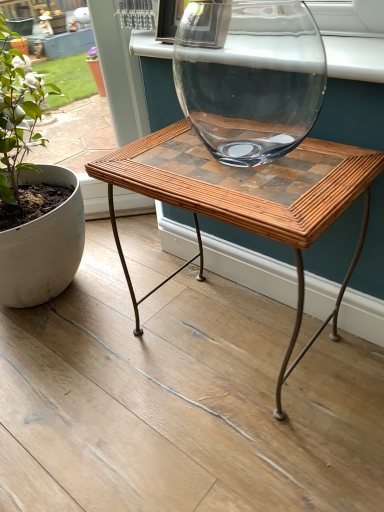
Question: From a real-world perspective, is green matte plant at left located beneath clear glass vase at upper center?

Choices:
 (A) yes
 (B) no

Answer: (A)

Question: Does green matte plant at left have a lesser width compared to clear glass vase at upper center?

Choices:
 (A) yes
 (B) no

Answer: (B)

Question: Is green matte plant at left positioned before clear glass vase at upper center?

Choices:
 (A) yes
 (B) no

Answer: (A)

Question: From the image's perspective, does green matte plant at left appear higher than clear glass vase at upper center?

Choices:
 (A) yes
 (B) no

Answer: (B)

Question: Is green matte plant at left shorter than clear glass vase at upper center?

Choices:
 (A) yes
 (B) no

Answer: (B)

Question: From the image's perspective, is green matte plant at left beneath clear glass vase at upper center?

Choices:
 (A) yes
 (B) no

Answer: (A)

Question: Is woven wood table at center wider than clear glass vase at upper center?

Choices:
 (A) yes
 (B) no

Answer: (A)

Question: Is the depth of woven wood table at center greater than that of clear glass vase at upper center?

Choices:
 (A) no
 (B) yes

Answer: (A)

Question: From a real-world perspective, is woven wood table at center over clear glass vase at upper center?

Choices:
 (A) yes
 (B) no

Answer: (B)

Question: From the image's perspective, is woven wood table at center beneath clear glass vase at upper center?

Choices:
 (A) no
 (B) yes

Answer: (B)

Question: Is woven wood table at center positioned in front of clear glass vase at upper center?

Choices:
 (A) no
 (B) yes

Answer: (B)

Question: Can you confirm if woven wood table at center is positioned to the left of clear glass vase at upper center?

Choices:
 (A) no
 (B) yes

Answer: (A)

Question: Is the position of green matte plant at left more distant than that of woven wood table at center?

Choices:
 (A) no
 (B) yes

Answer: (B)